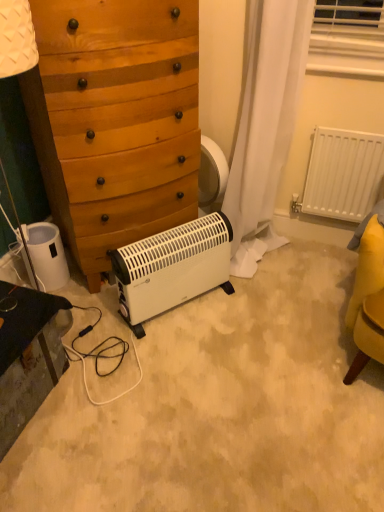
Where is `vacant space to the right of black glossy vanity at lower left`? vacant space to the right of black glossy vanity at lower left is located at coordinates click(x=97, y=408).